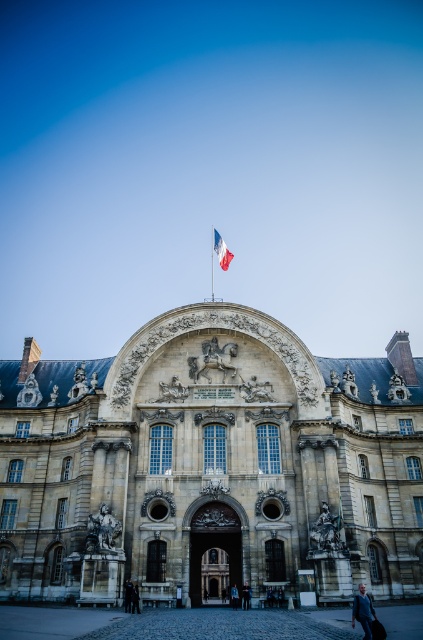
You are standing in front of the historic building and want to locate the stone textured palace at center. According to the coordinates provided, where should you look?

You should look at point (211, 465) to find the stone textured palace at center.

You are a photographer standing in front of the historic building. You want to capture a photo of both the blue fabric flag at center and the dark gray suit at center in the same frame. Based on their sizes, which object should you position closer to the camera to ensure both fit in the frame?

The blue fabric flag at center is wider than the dark gray suit at center. To fit both in the frame, position the blue fabric flag at center closer to the camera since its larger size requires more space, while the dark gray suit at center can be placed slightly farther back to maintain balance.